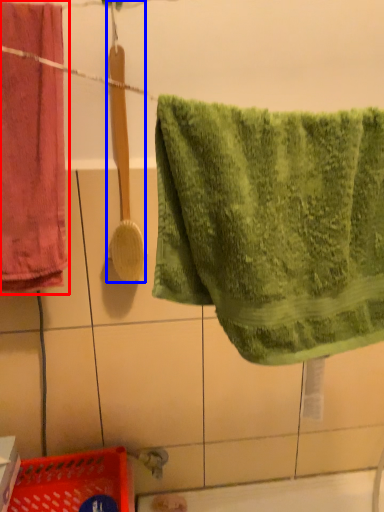
Question: Among these objects, which one is nearest to the camera, towel (highlighted by a red box) or brush (highlighted by a blue box)?

Choices:
 (A) towel
 (B) brush

Answer: (A)